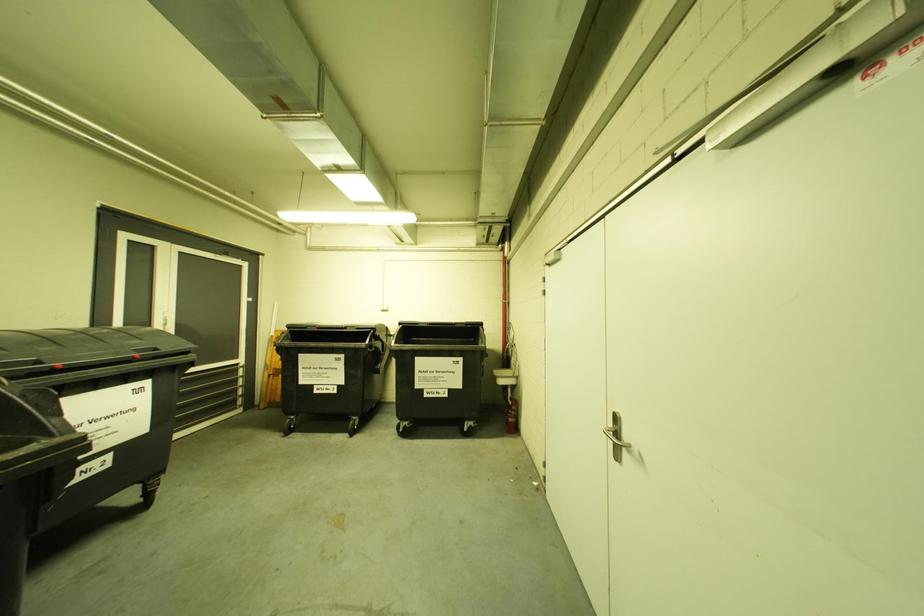
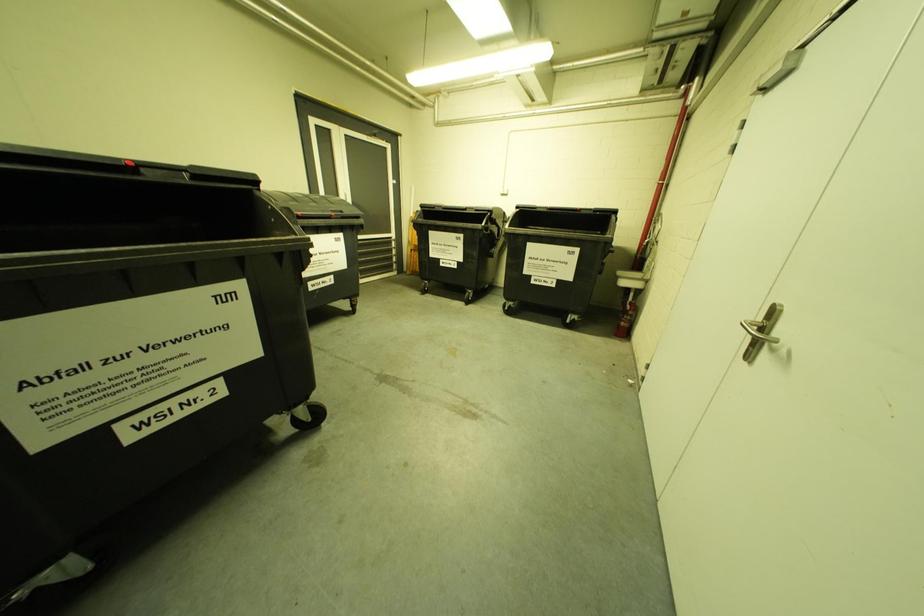
The first image is from the beginning of the video and the second image is from the end. How did the camera likely rotate when shooting the video?

The camera rotated toward left-down.